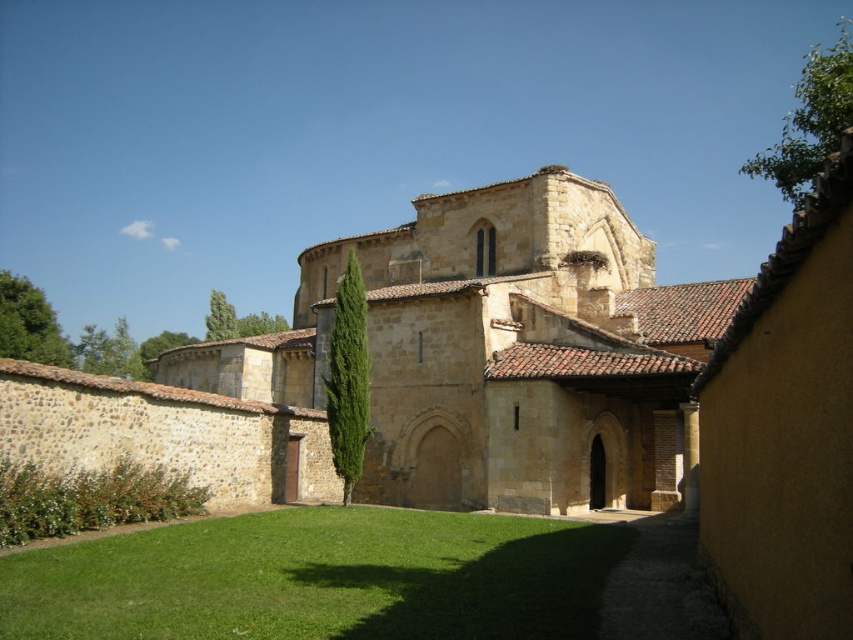
Looking at this image, you are standing in the historic area and want to take a photo of the beige stone chapel at center and the green grass at center. Which object should you focus on first to ensure both are in the frame?

You should focus on the beige stone chapel at center first because it is closer to you than the green grass at center, so adjusting the camera to capture it ensures both will be in the frame.

You are standing in the historic setting described and want to walk from the green grass at center to the beige stone chapel at center. Which direction should you move in?

You should move to the left because the beige stone chapel at center is to the right of green grass at center, so moving left from the grass will lead you towards the chapel.